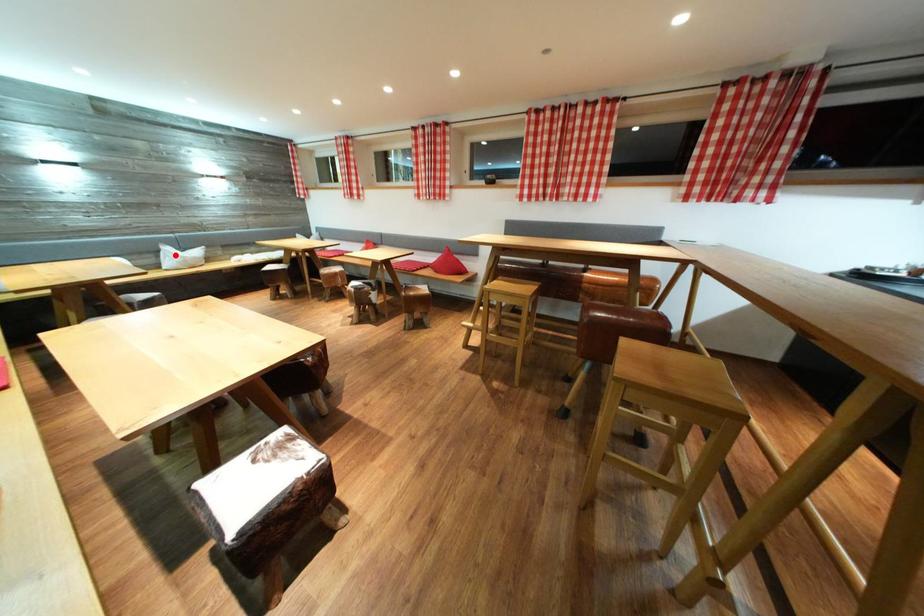
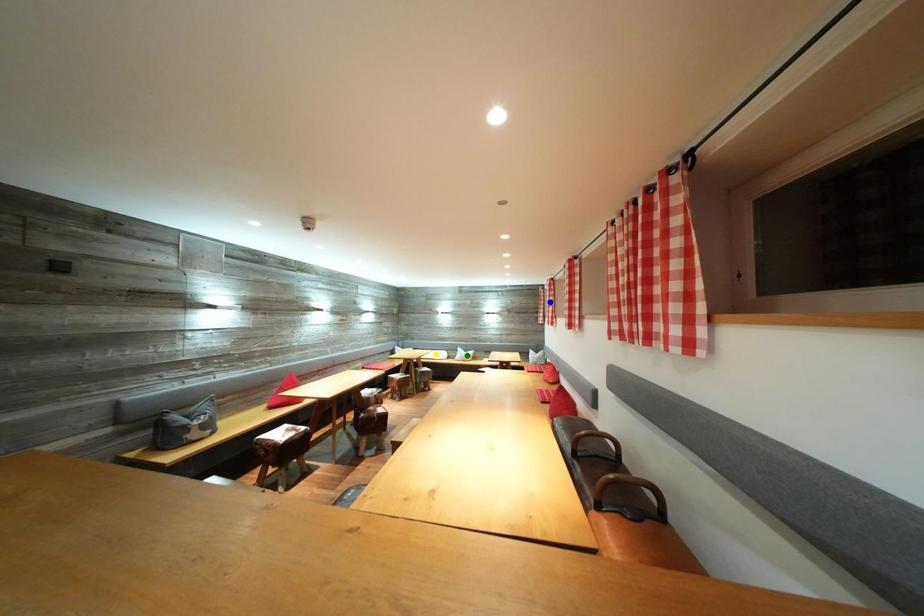
Question: I am providing you with two images of the same scene from different viewpoints. A red point is marked on the first image. You are given multiple points on the second image. Which point in image 2 is actually the same real-world point as the red point in image 1?

Choices:
 (A) blue point
 (B) yellow point
 (C) green point

Answer: (C)